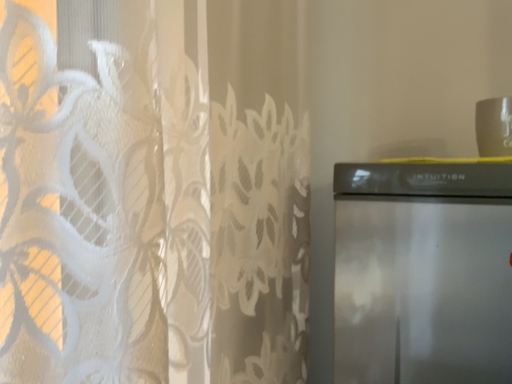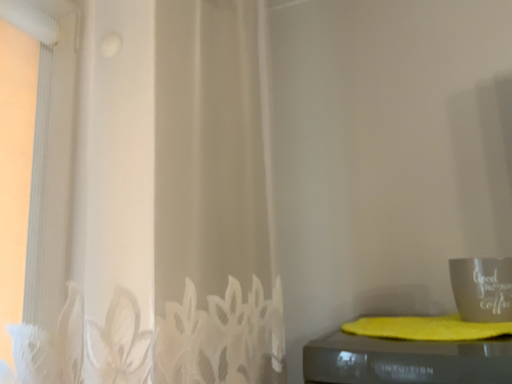
Question: How did the camera likely rotate when shooting the video?

Choices:
 (A) rotated upward
 (B) rotated downward

Answer: (A)